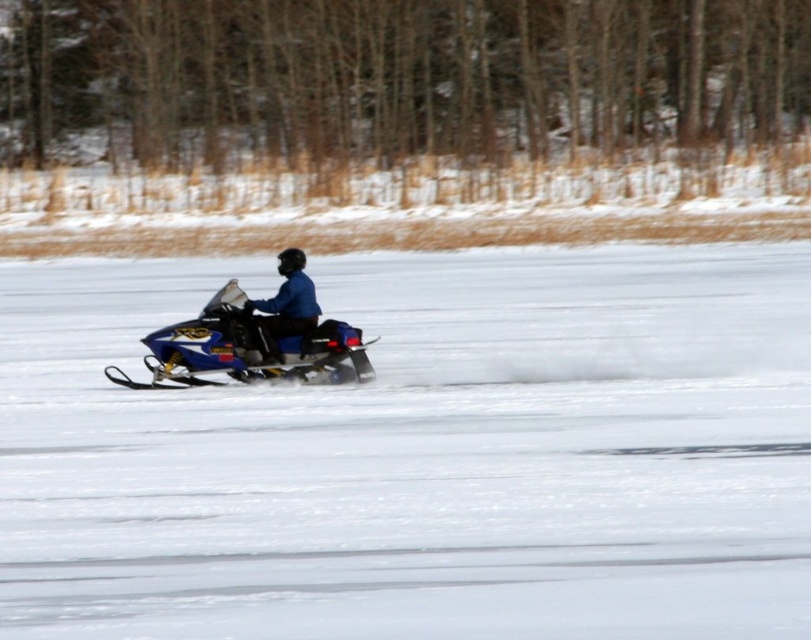
Question: Is blue metallic snowmobile at center to the right of blue matte snowmobile at center from the viewer's perspective?

Choices:
 (A) yes
 (B) no

Answer: (B)

Question: Is blue metallic snowmobile at center below blue matte snowmobile at center?

Choices:
 (A) yes
 (B) no

Answer: (A)

Question: Which point is closer to the camera?

Choices:
 (A) blue matte snowmobile at center
 (B) blue metallic snowmobile at center

Answer: (B)

Question: Is blue metallic snowmobile at center behind blue matte snowmobile at center?

Choices:
 (A) no
 (B) yes

Answer: (A)

Question: Which object is farther from the camera taking this photo?

Choices:
 (A) blue metallic snowmobile at center
 (B) blue matte snowmobile at center

Answer: (B)